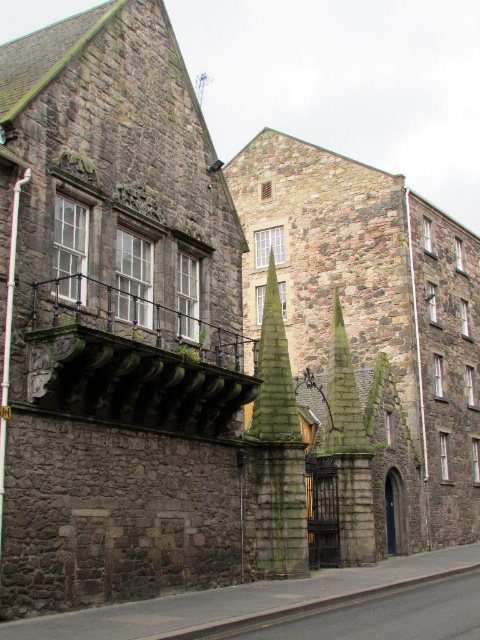
You are standing in front of the historic stone building and notice two spires. The first is the smooth stone spire at center, and the second is the dark gray stone spire at center. Which spire is positioned to the left when viewed from your current perspective?

The smooth stone spire at center is positioned to the left of the dark gray stone spire at center.